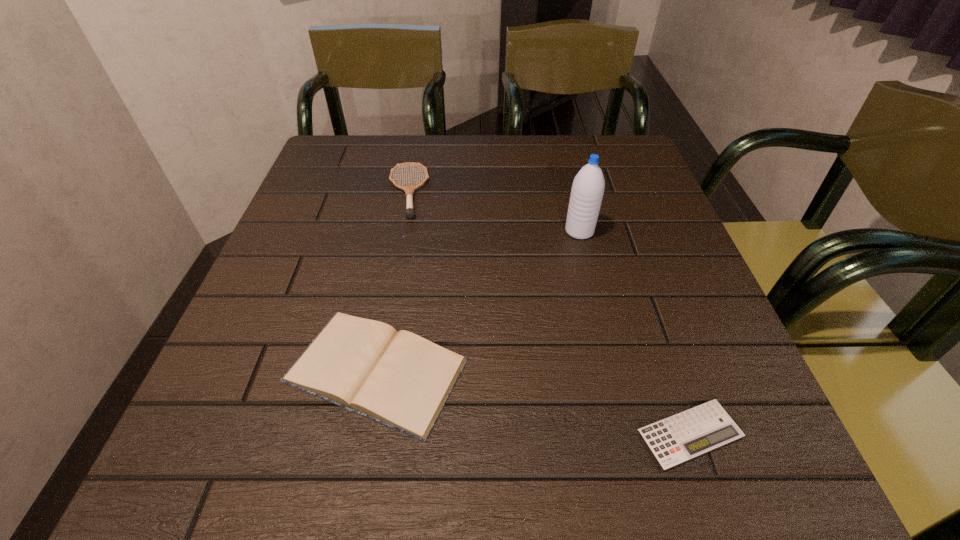
Identify the location of Bible present at the near edge. (399, 379).

The height and width of the screenshot is (540, 960). Identify the location of calculator situated at the near edge. (677, 439).

In order to click on object that is at the left edge in this screenshot , I will do `click(399, 379)`.

Identify the location of object located in the right edge section of the desktop. The image size is (960, 540). (677, 439).

The height and width of the screenshot is (540, 960). I want to click on object situated at the near left corner, so click(x=399, y=379).

Locate an element on the screen. The width and height of the screenshot is (960, 540). object at the near right corner is located at coordinates (677, 439).

In the image, there is a desktop. At what (x,y) coordinates should I click in order to perform the action: click on vacant region at the far edge. Please return your answer as a coordinate pair (x, y). Image resolution: width=960 pixels, height=540 pixels. Looking at the image, I should click on (570, 167).

Locate an element on the screen. This screenshot has height=540, width=960. free space at the near edge of the desktop is located at coordinates (591, 469).

Where is `vacant space at the left edge of the desktop`? vacant space at the left edge of the desktop is located at coordinates (330, 292).

Locate an element on the screen. The height and width of the screenshot is (540, 960). vacant region at the right edge of the desktop is located at coordinates (668, 311).